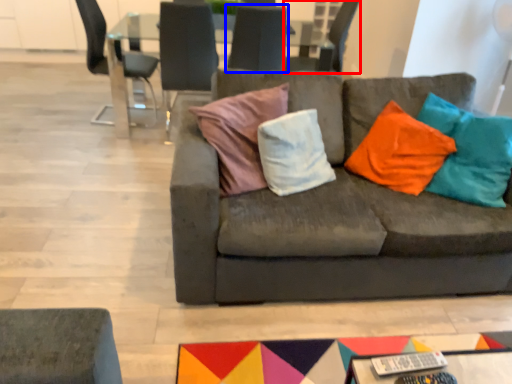
Question: Which of the following is the closest to the observer, chair (highlighted by a red box) or chair (highlighted by a blue box)?

Choices:
 (A) chair
 (B) chair

Answer: (B)